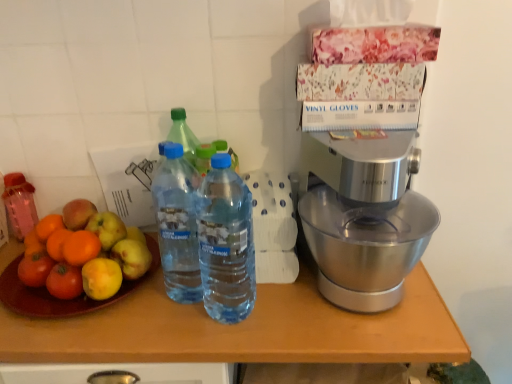
At what (x,y) coordinates should I click in order to perform the action: click on free location in front of silver metallic mixer at right. Please return your answer as a coordinate pair (x, y). Looking at the image, I should click on (369, 335).